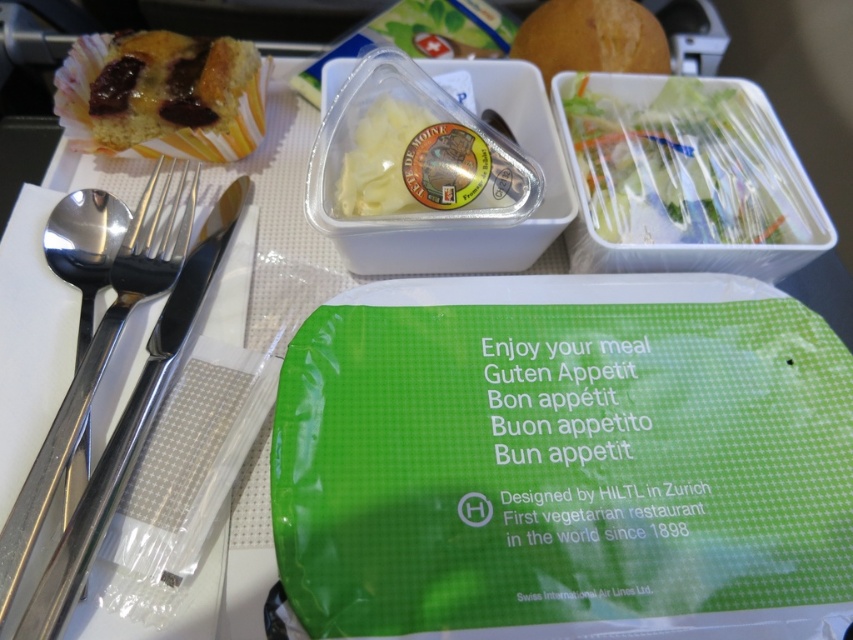
You are a GUI agent. You are given a task and a screenshot of the screen. Output one action in this format:
    pyautogui.click(x=<x>, y=<y>)
    Task: Click on the golden brown cake at upper left
    This screenshot has height=640, width=853.
    Given the screenshot: What is the action you would take?
    pyautogui.click(x=161, y=96)

Measure the distance between point (82, 36) and camera.

A distance of 29.97 inches exists between point (82, 36) and camera.

What do you see at coordinates (161, 96) in the screenshot? I see `golden brown cake at upper left` at bounding box center [161, 96].

Locate an element on the screen. golden brown cake at upper left is located at coordinates (161, 96).

Can you confirm if golden brown cake at upper left is wider than translucent plastic cheese at center?

Yes.

Is point (99, 132) in front of point (424, 120)?

No, (99, 132) is further to viewer.

Identify the location of golden brown cake at upper left. This screenshot has height=640, width=853. pos(161,96).

Where is `translucent plastic salad at upper right`? The image size is (853, 640). translucent plastic salad at upper right is located at coordinates (688, 168).

Is translucent plastic salad at upper right below satin finish silverware at left?

No.

Is point (741, 97) positioned after point (39, 582)?

Yes, point (741, 97) is farther from viewer.

The width and height of the screenshot is (853, 640). In order to click on translucent plastic salad at upper right in this screenshot , I will do `click(688, 168)`.